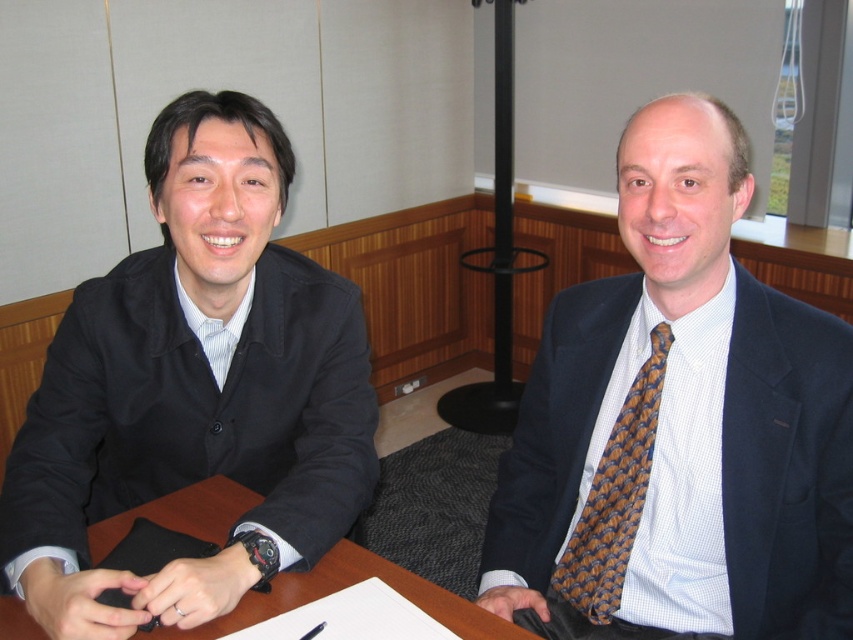
Question: Does brown wooden table at center lie behind brown woven tie at right?

Choices:
 (A) no
 (B) yes

Answer: (A)

Question: Where is brown wooden table at center located in relation to brown woven tie at right in the image?

Choices:
 (A) below
 (B) above

Answer: (A)

Question: Which point appears closest to the camera in this image?

Choices:
 (A) (721, 141)
 (B) (485, 621)
 (C) (111, 500)

Answer: (A)

Question: Can you confirm if black matte suit at left is positioned below brown wooden table at center?

Choices:
 (A) yes
 (B) no

Answer: (B)

Question: Estimate the real-world distances between objects in this image. Which object is closer to the black matte suit at left?

Choices:
 (A) brown woven tie at right
 (B) brown wooden table at center

Answer: (B)

Question: Which point is closer to the camera?

Choices:
 (A) (112, 481)
 (B) (724, 157)

Answer: (B)